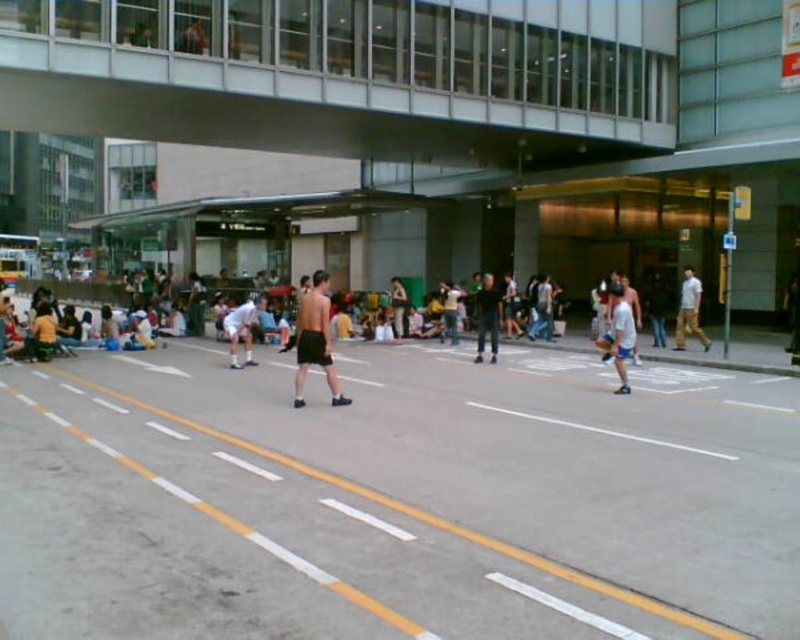
Between black matte shorts at center and white cotton shirt at center, which one appears on the left side from the viewer's perspective?

black matte shorts at center is more to the left.

Does point (300, 298) lie in front of point (674, 346)?

No, it is not.

Who is more distant from viewer, (316,276) or (682,346)?

Positioned behind is point (682,346).

Where is `black matte shorts at center`? black matte shorts at center is located at coordinates (316, 340).

Can you confirm if dark blue jeans at center is positioned to the right of white cotton shirt at center?

No, dark blue jeans at center is not to the right of white cotton shirt at center.

Does point (488, 292) come in front of point (696, 304)?

Yes.

This screenshot has width=800, height=640. What are the coordinates of `dark blue jeans at center` in the screenshot? It's located at (488, 316).

Between black matte shorts at center and dark blue jeans at center, which one is positioned higher?

black matte shorts at center

Can you confirm if black matte shorts at center is bigger than dark blue jeans at center?

Indeed, black matte shorts at center has a larger size compared to dark blue jeans at center.

Which is behind, point (296, 372) or point (496, 346)?

The point (496, 346) is behind.

Where is `black matte shorts at center`? black matte shorts at center is located at coordinates [316, 340].